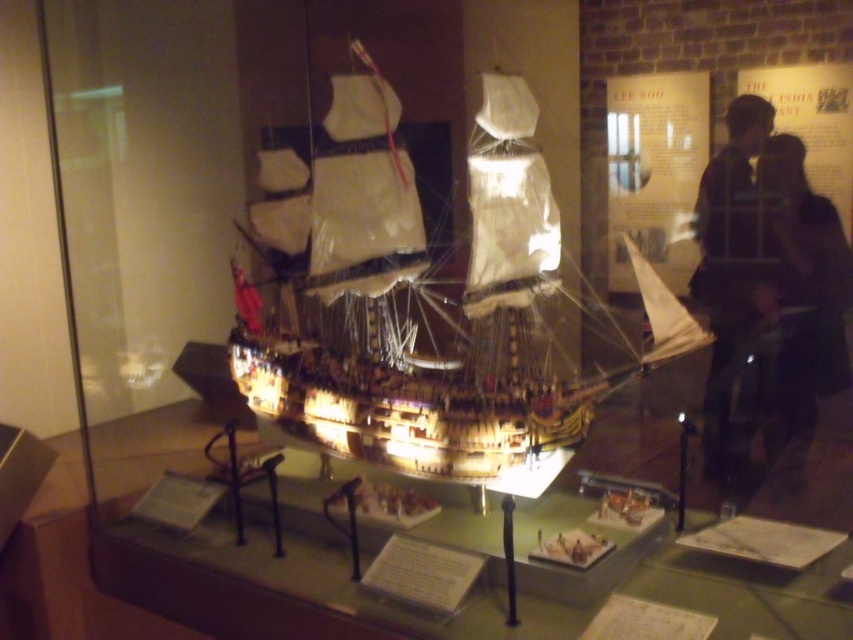
Between wooden ship at center and dark brown leather jacket at right, which one appears on the right side from the viewer's perspective?

dark brown leather jacket at right is more to the right.

Which is in front, point (254, 376) or point (721, 483)?

Point (721, 483)

Measure the distance between wooden ship at center and camera.

The distance of wooden ship at center from camera is 2.73 meters.

Where is `wooden ship at center`? The width and height of the screenshot is (853, 640). wooden ship at center is located at coordinates (421, 300).

Between dark fabric jacket at right and dark brown leather jacket at right, which one has less height?

Standing shorter between the two is dark fabric jacket at right.

Is dark fabric jacket at right behind dark brown leather jacket at right?

No, it is in front of dark brown leather jacket at right.

You are a GUI agent. You are given a task and a screenshot of the screen. Output one action in this format:
    pyautogui.click(x=<x>, y=<y>)
    Task: Click on the dark fabric jacket at right
    The image size is (853, 640).
    Given the screenshot: What is the action you would take?
    pyautogui.click(x=801, y=301)

In order to click on wooden ship at center in this screenshot , I will do `click(421, 300)`.

Can you confirm if wooden ship at center is smaller than dark fabric jacket at right?

Actually, wooden ship at center might be larger than dark fabric jacket at right.

Who is more forward, (334, 300) or (809, 288)?

Point (809, 288)

In order to click on wooden ship at center in this screenshot , I will do `click(421, 300)`.